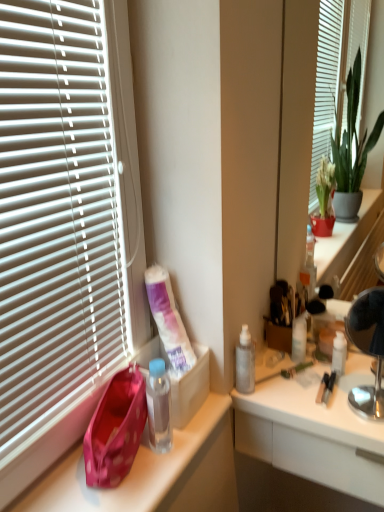
Question: Does transparent plastic bottle at center-right appear on the right side of metallic silver lamp at right?

Choices:
 (A) yes
 (B) no

Answer: (B)

Question: Is transparent plastic bottle at center-right positioned beyond the bounds of metallic silver lamp at right?

Choices:
 (A) yes
 (B) no

Answer: (A)

Question: From a real-world perspective, is transparent plastic bottle at center-right below metallic silver lamp at right?

Choices:
 (A) yes
 (B) no

Answer: (A)

Question: Is transparent plastic bottle at center-right oriented towards metallic silver lamp at right?

Choices:
 (A) no
 (B) yes

Answer: (A)

Question: From a real-world perspective, is transparent plastic bottle at center-right over metallic silver lamp at right?

Choices:
 (A) yes
 (B) no

Answer: (B)

Question: Is transparent plastic bottle at center-right smaller than metallic silver lamp at right?

Choices:
 (A) no
 (B) yes

Answer: (B)

Question: Can you confirm if metallic silver mirror at right is positioned to the left of translucent plastic bottles at center?

Choices:
 (A) no
 (B) yes

Answer: (A)

Question: Is metallic silver mirror at right in front of translucent plastic bottles at center?

Choices:
 (A) no
 (B) yes

Answer: (B)

Question: From a real-world perspective, is metallic silver mirror at right beneath translucent plastic bottles at center?

Choices:
 (A) yes
 (B) no

Answer: (B)

Question: From a real-world perspective, is metallic silver mirror at right positioned over translucent plastic bottles at center based on gravity?

Choices:
 (A) yes
 (B) no

Answer: (A)

Question: From the image's perspective, is metallic silver mirror at right below translucent plastic bottles at center?

Choices:
 (A) no
 (B) yes

Answer: (A)

Question: Is metallic silver mirror at right facing towards translucent plastic bottles at center?

Choices:
 (A) no
 (B) yes

Answer: (A)

Question: Is white matte tube at lower left not close to pink fabric handbag at left?

Choices:
 (A) yes
 (B) no

Answer: (B)